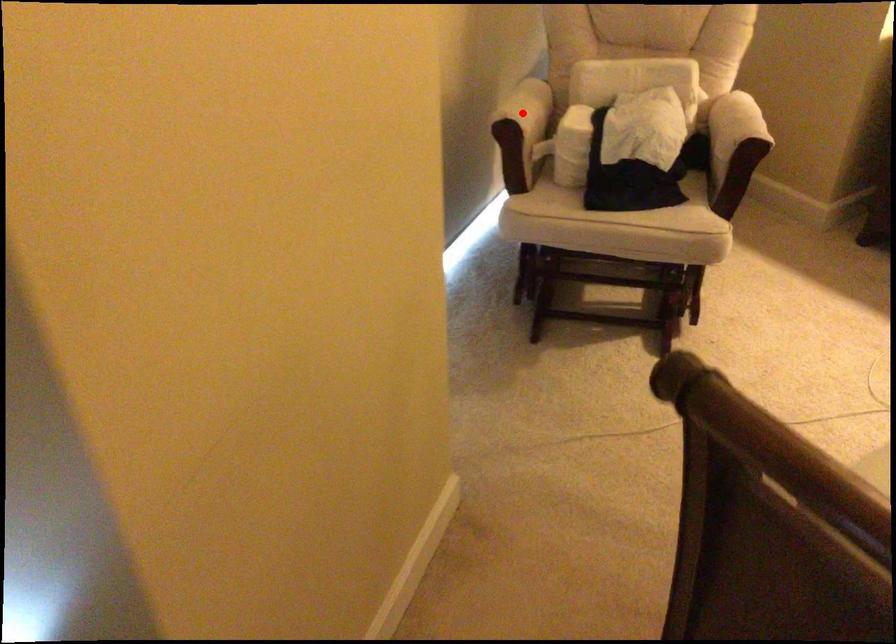
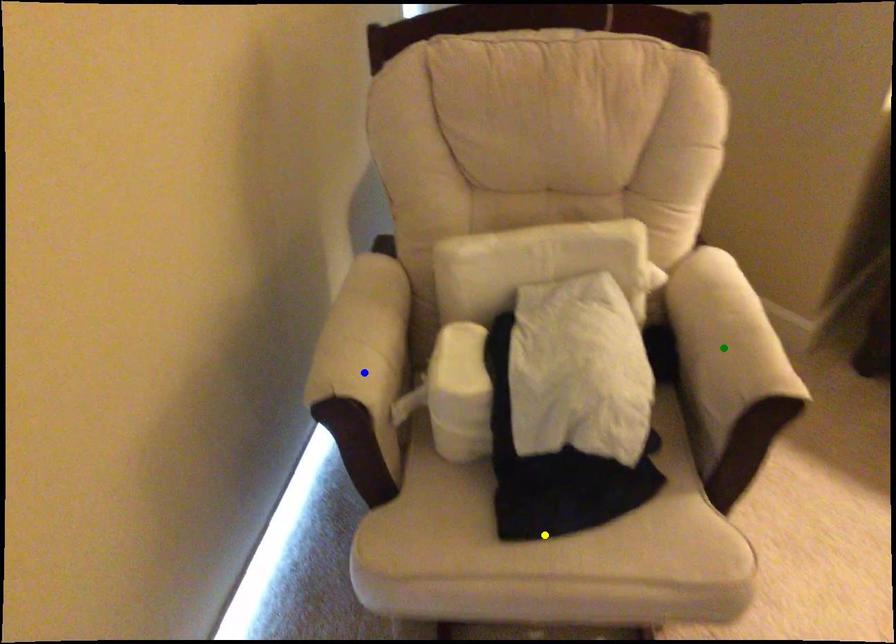
Question: I am providing you with two images of the same scene from different viewpoints. A red point is marked on the first image. You are given multiple points on the second image. Which point in image 2 represents the same 3d spot as the red point in image 1?

Choices:
 (A) blue point
 (B) green point
 (C) yellow point

Answer: (A)